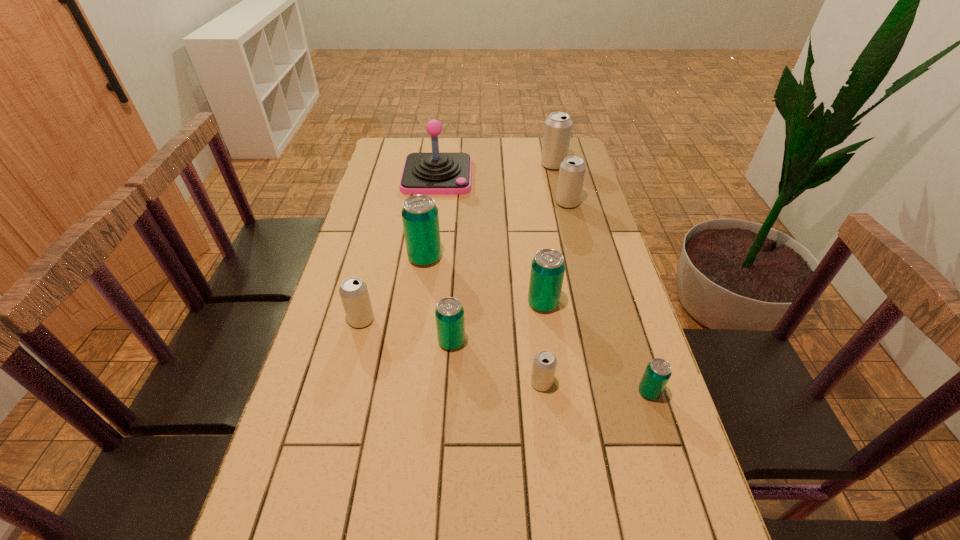
At what (x,y) coordinates should I click in order to perform the action: click on the sixth farthest beer can. Please return your answer as a coordinate pair (x, y). Looking at the image, I should click on (449, 313).

Image resolution: width=960 pixels, height=540 pixels. What are the coordinates of `the third farthest white beer can` in the screenshot? It's located at (353, 291).

Identify the location of the leftmost white beer can. The height and width of the screenshot is (540, 960). (353, 291).

Where is `the third white beer can from right to left`? the third white beer can from right to left is located at coordinates click(x=544, y=365).

Locate an element on the screen. This screenshot has height=540, width=960. the smallest white beer can is located at coordinates pos(544,365).

The height and width of the screenshot is (540, 960). I want to click on the rightmost beer can, so click(658, 372).

Identify the location of the rightmost teal beer can. This screenshot has height=540, width=960. (658, 372).

You are a GUI agent. You are given a task and a screenshot of the screen. Output one action in this format:
    pyautogui.click(x=<x>, y=<y>)
    Task: Click on the vacant space situated forward from the base of the pink joystick
    
    Given the screenshot: What is the action you would take?
    pyautogui.click(x=426, y=262)

Where is `blank area located 0.120m on the front of the farthest white beer can`? This screenshot has width=960, height=540. blank area located 0.120m on the front of the farthest white beer can is located at coordinates (559, 189).

Identify the location of blank space located 0.310m on the back of the sixth nearest object. The image size is (960, 540). (434, 191).